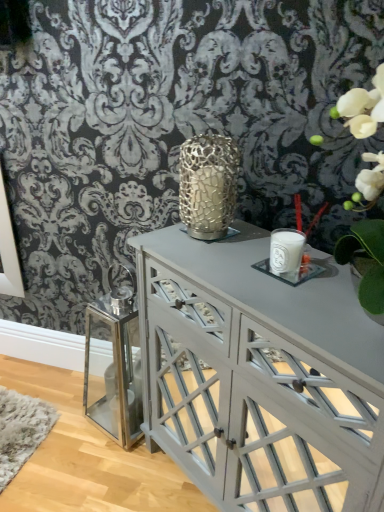
The image size is (384, 512). What are the coordinates of `vacant area in front of white glass candle at center, marked as the 2th candle holder in a top-to-bottom arrangement` in the screenshot? It's located at (305, 308).